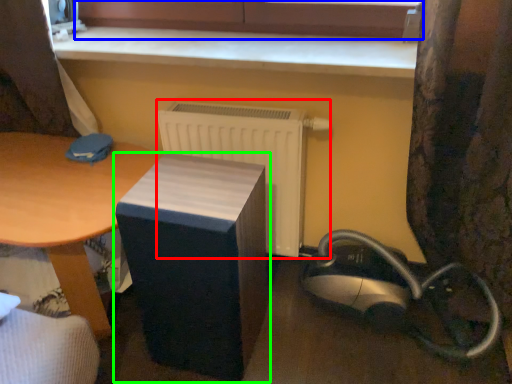
Question: Which object is the closest to the radiator (highlighted by a red box)? Choose among these: bay window (highlighted by a blue box) or furniture (highlighted by a green box).

Choices:
 (A) bay window
 (B) furniture

Answer: (B)